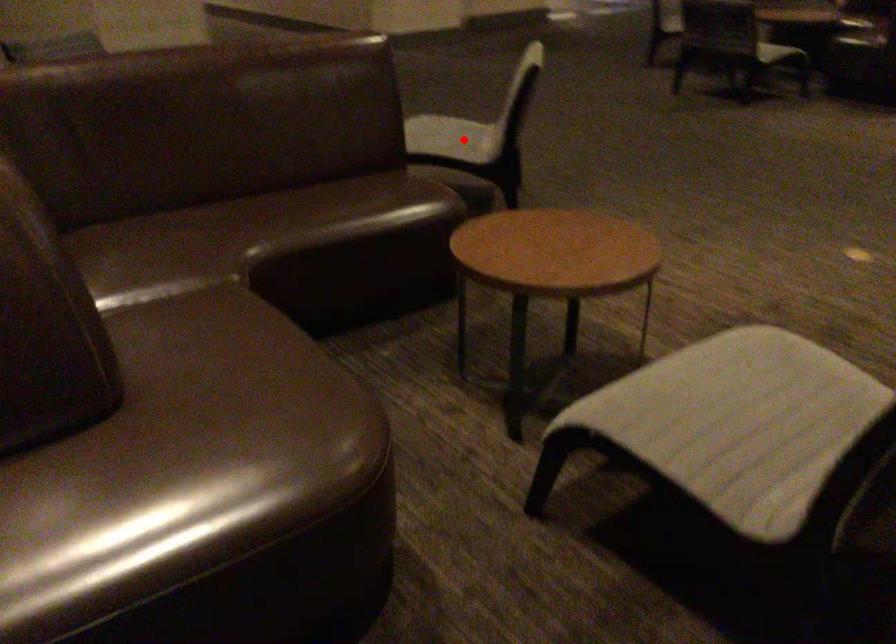
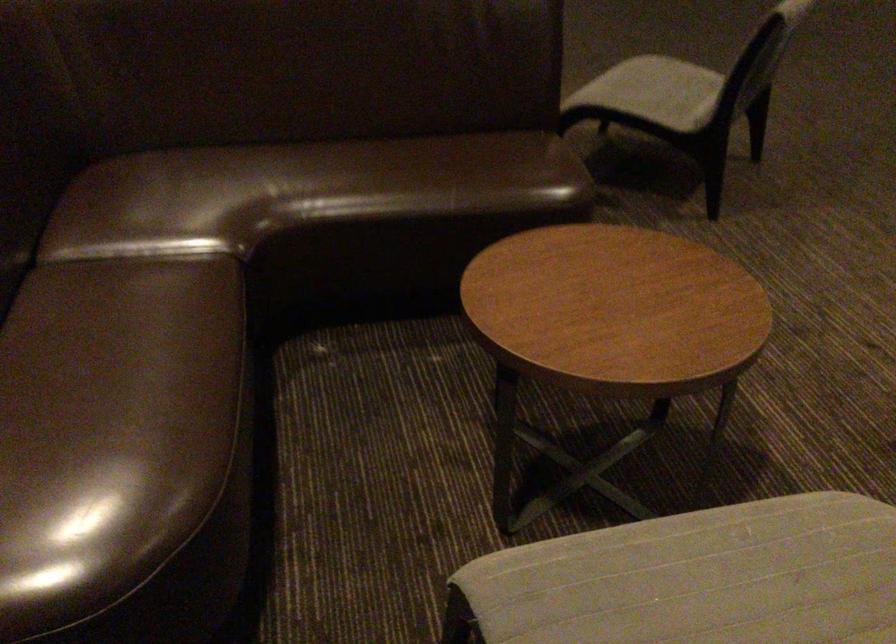
Question: I am providing you with two images of the same scene from different viewpoints. In image1, a red point is highlighted. Considering the same 3D point in image2, which of the following is correct?

Choices:
 (A) It is closer
 (B) It is farther

Answer: (A)